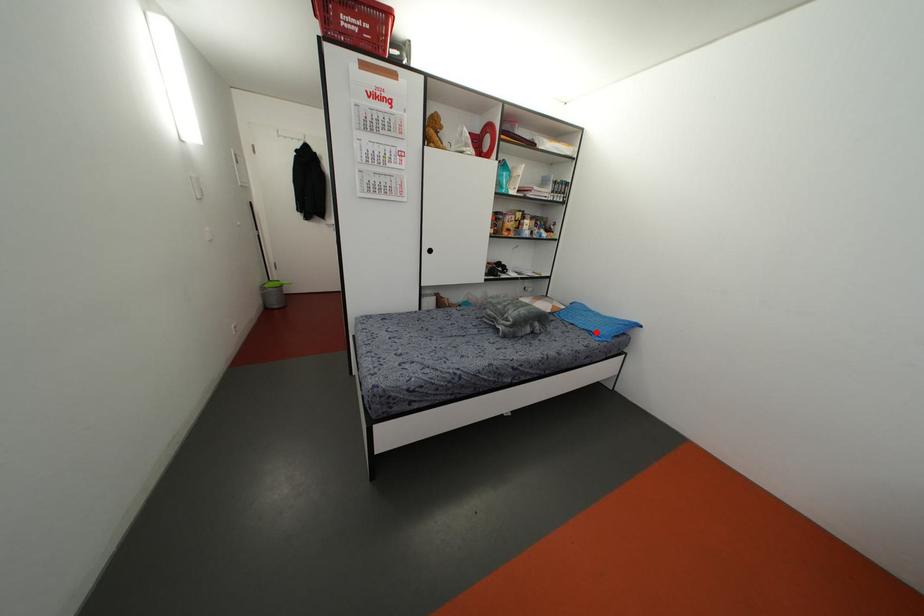
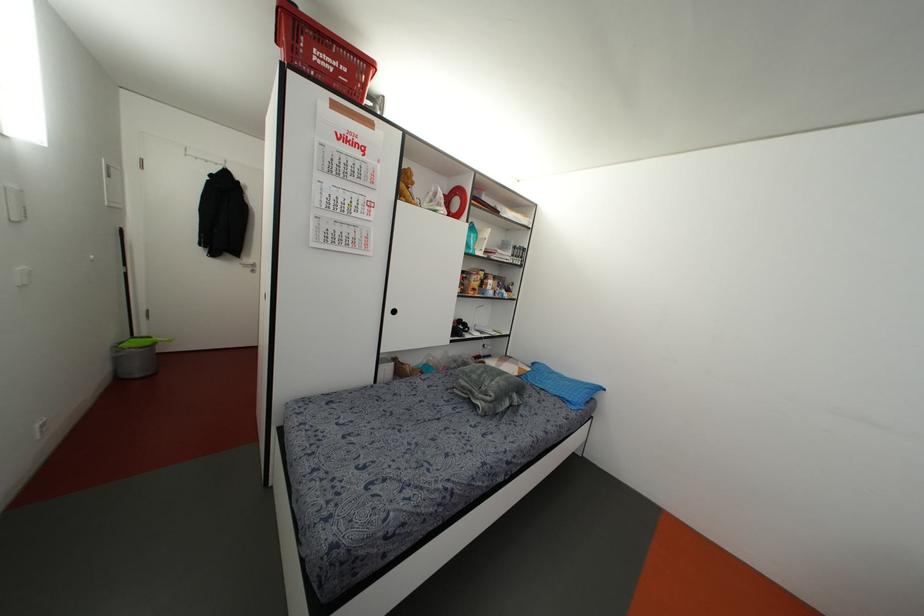
The point at the highlighted location is marked in the first image. Where is the corresponding point in the second image?

(569, 399)